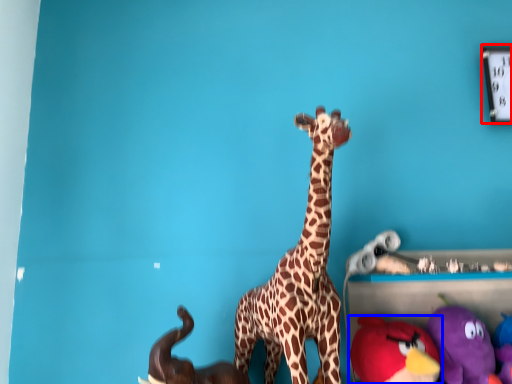
Question: Which point is closer to the camera, clock (highlighted by a red box) or toy (highlighted by a blue box)?

Choices:
 (A) clock
 (B) toy

Answer: (B)